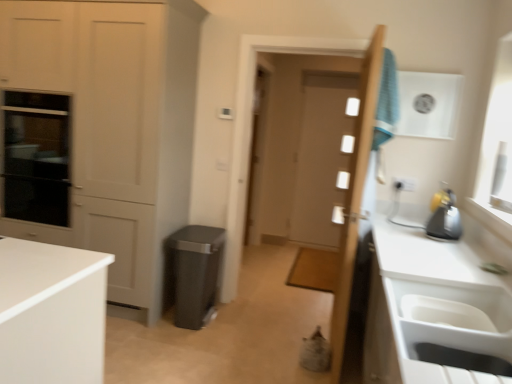
Question: From the image's perspective, is clear glass screen door at center over wooden door at center, the 2th door in the back-to-front sequence?

Choices:
 (A) no
 (B) yes

Answer: (B)

Question: From a real-world perspective, is clear glass screen door at center positioned under wooden door at center, arranged as the 1th door when viewed from the front, based on gravity?

Choices:
 (A) no
 (B) yes

Answer: (B)

Question: Does clear glass screen door at center have a greater width compared to wooden door at center, the 2th door in the back-to-front sequence?

Choices:
 (A) yes
 (B) no

Answer: (B)

Question: From a real-world perspective, does clear glass screen door at center stand above wooden door at center, the 2th door in the back-to-front sequence?

Choices:
 (A) no
 (B) yes

Answer: (A)

Question: Would you say wooden door at center, the 2th door in the back-to-front sequence, is part of clear glass screen door at center's contents?

Choices:
 (A) no
 (B) yes

Answer: (A)

Question: Relative to white glossy door at center, the second door when ordered from front to back, is matte plastic trash can at center in front or behind?

Choices:
 (A) front
 (B) behind

Answer: (A)

Question: Looking at their shapes, would you say matte plastic trash can at center is wider or thinner than white glossy door at center, which ranks as the first door in back-to-front order?

Choices:
 (A) wide
 (B) thin

Answer: (A)

Question: From the image's perspective, is matte plastic trash can at center positioned above or below white glossy door at center, which ranks as the first door in back-to-front order?

Choices:
 (A) above
 (B) below

Answer: (B)

Question: Is point (197, 259) closer or farther from the camera than point (332, 102)?

Choices:
 (A) farther
 (B) closer

Answer: (B)

Question: Considering the positions of point coord(480,292) and point coord(260,82), is point coord(480,292) closer or farther from the camera than point coord(260,82)?

Choices:
 (A) closer
 (B) farther

Answer: (A)

Question: Is white plastic sink at lower right to the left or to the right of clear glass screen door at center in the image?

Choices:
 (A) right
 (B) left

Answer: (A)

Question: From a real-world perspective, is white plastic sink at lower right physically located above or below clear glass screen door at center?

Choices:
 (A) above
 (B) below

Answer: (B)

Question: Considering the positions of white plastic sink at lower right and clear glass screen door at center in the image, is white plastic sink at lower right bigger or smaller than clear glass screen door at center?

Choices:
 (A) small
 (B) big

Answer: (B)

Question: Considering the positions of blue fabric laundry at upper right and wooden door at center, arranged as the 1th door when viewed from the front, in the image, is blue fabric laundry at upper right taller or shorter than wooden door at center, arranged as the 1th door when viewed from the front,?

Choices:
 (A) short
 (B) tall

Answer: (A)

Question: From a real-world perspective, is blue fabric laundry at upper right positioned above or below wooden door at center, arranged as the 1th door when viewed from the front?

Choices:
 (A) above
 (B) below

Answer: (A)